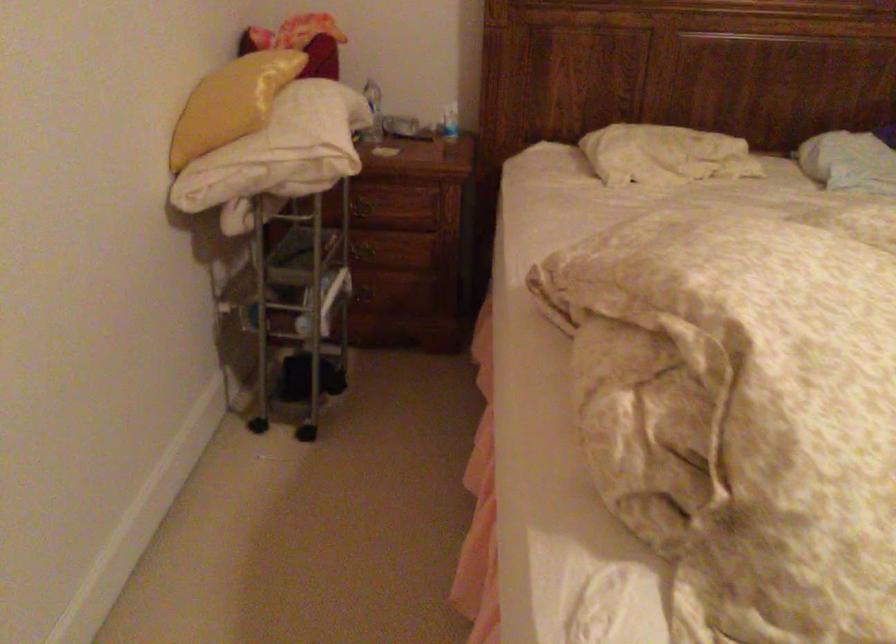
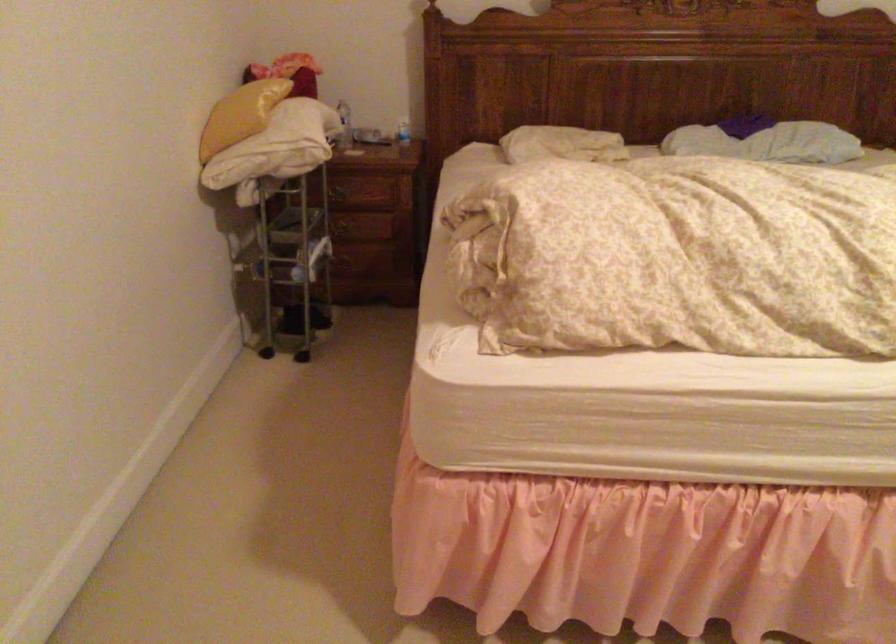
Where in the second image is the point corresponding to point (373, 120) from the first image?

(343, 125)